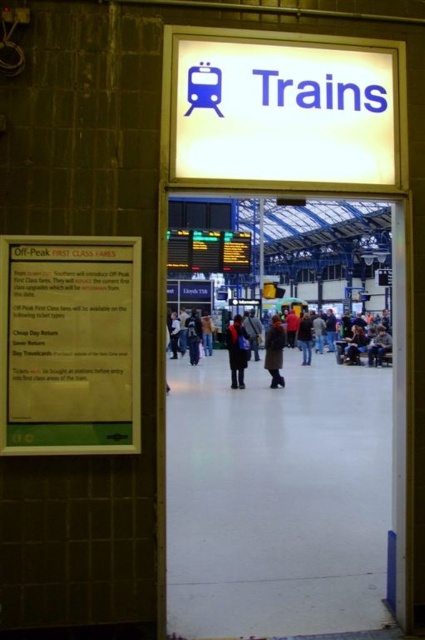
Is point (189, 586) closer to camera compared to point (186, 330)?

Yes.

Can you confirm if transparent glass door at center is smaller than dark brown leather coat at center?

No, transparent glass door at center is not smaller than dark brown leather coat at center.

What do you see at coordinates (289, 429) in the screenshot?
I see `transparent glass door at center` at bounding box center [289, 429].

Image resolution: width=425 pixels, height=640 pixels. I want to click on transparent glass door at center, so click(289, 429).

Does green paper sign at left have a lesser height compared to dark blue jeans at center?

Yes, green paper sign at left is shorter than dark blue jeans at center.

Who is higher up, green paper sign at left or dark blue jeans at center?

green paper sign at left is higher up.

The width and height of the screenshot is (425, 640). I want to click on green paper sign at left, so click(68, 346).

The width and height of the screenshot is (425, 640). I want to click on green paper sign at left, so click(x=68, y=346).

Is dark brown coat at center to the left of dark gray jacket at center from the viewer's perspective?

In fact, dark brown coat at center is to the right of dark gray jacket at center.

The width and height of the screenshot is (425, 640). In order to click on dark brown coat at center in this screenshot , I will do `click(274, 352)`.

Which is behind, point (277, 330) or point (197, 330)?

Positioned behind is point (197, 330).

You are a GUI agent. You are given a task and a screenshot of the screen. Output one action in this format:
    pyautogui.click(x=<x>, y=<y>)
    Task: Click on the dark brown coat at center
    Image resolution: width=425 pixels, height=640 pixels.
    Given the screenshot: What is the action you would take?
    click(274, 352)